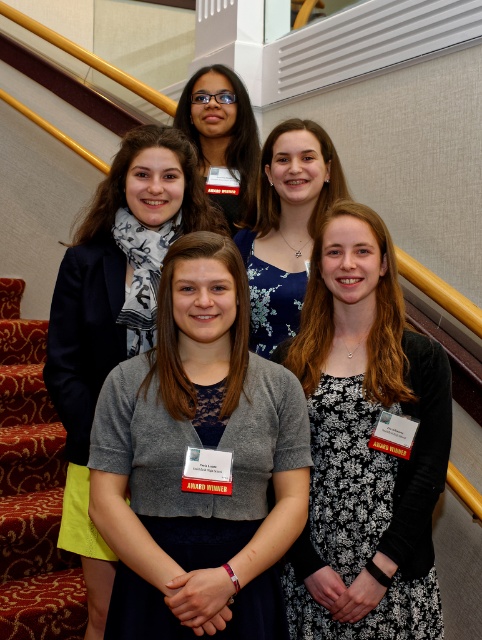
Question: Which is nearer to the black floral dress at center?

Choices:
 (A) gray knit cardigan at center
 (B) matte black glasses at upper center
 (C) blue floral dress at center
 (D) gray matte cardigan at center

Answer: (D)

Question: Can you confirm if gray matte cardigan at center is smaller than matte black glasses at upper center?

Choices:
 (A) no
 (B) yes

Answer: (A)

Question: Is black floral dress at center below gray knit cardigan at center?

Choices:
 (A) yes
 (B) no

Answer: (A)

Question: Can you confirm if gray matte cardigan at center is wider than blue floral dress at center?

Choices:
 (A) yes
 (B) no

Answer: (A)

Question: Estimate the real-world distances between objects in this image. Which object is farther from the black floral dress at center?

Choices:
 (A) matte black glasses at upper center
 (B) gray matte cardigan at center

Answer: (A)

Question: Which object is closer to the camera taking this photo?

Choices:
 (A) gray knit cardigan at center
 (B) gray matte cardigan at center

Answer: (B)